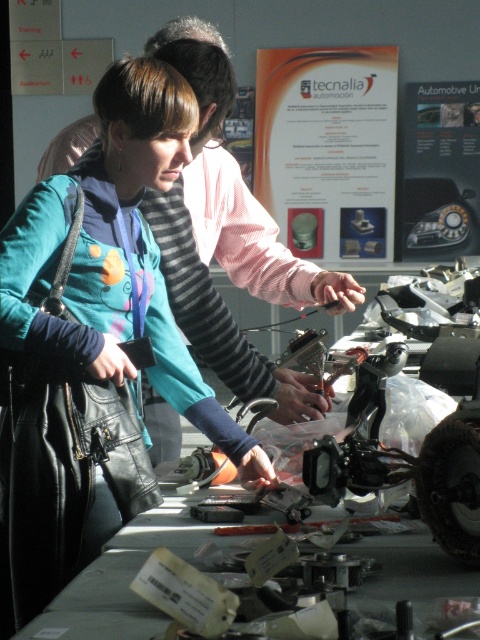
Which is above, teal fabric jacket at center or metallic gray tools at center?

teal fabric jacket at center is above.

From the picture: Does teal fabric jacket at center have a lesser width compared to metallic gray tools at center?

Yes, teal fabric jacket at center is thinner than metallic gray tools at center.

In the scene shown: Measure the distance between point (155, 356) and camera.

Point (155, 356) and camera are 7.03 feet apart from each other.

Find the location of a particular element. The width and height of the screenshot is (480, 640). teal fabric jacket at center is located at coordinates (95, 339).